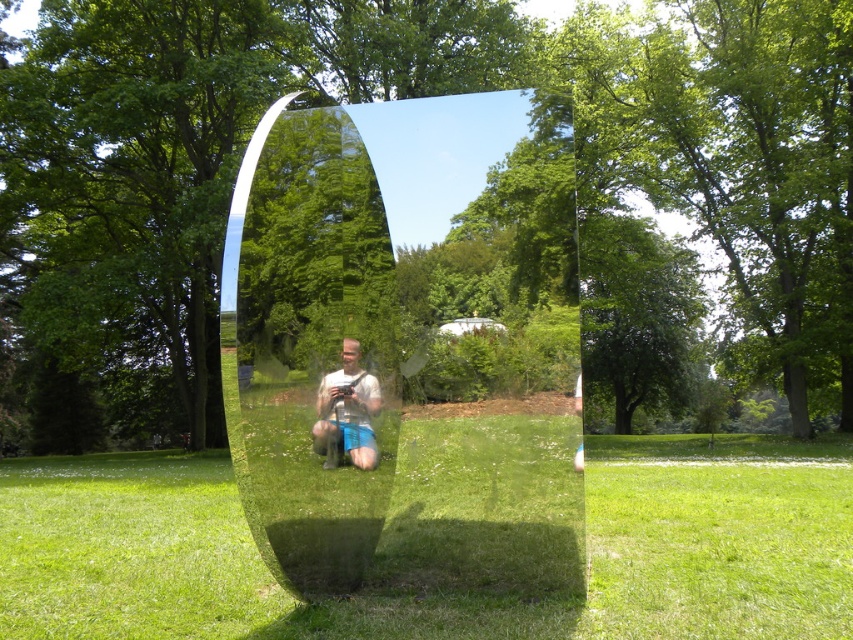
Describe the element at coordinates (407, 344) in the screenshot. The height and width of the screenshot is (640, 853). I see `transparent glass sculpture at center` at that location.

Does point (502, 177) come in front of point (39, 608)?

No, (502, 177) is further to viewer.

Locate an element on the screen. transparent glass sculpture at center is located at coordinates pos(407,344).

Can you confirm if green grass at lower center is bigger than matte silver camera at center?

Correct, green grass at lower center is larger in size than matte silver camera at center.

Between green grass at lower center and matte silver camera at center, which one has less height?

With less height is matte silver camera at center.

Who is more forward, (767, 444) or (350, 348)?

Point (350, 348)

The width and height of the screenshot is (853, 640). I want to click on green grass at lower center, so click(x=433, y=592).

Which is more to the right, transparent glass sculpture at center or matte silver camera at center?

transparent glass sculpture at center

Is point (349, 320) positioned in front of point (332, 451)?

No.

At what (x,y) coordinates should I click in order to perform the action: click on transparent glass sculpture at center. Please return your answer as a coordinate pair (x, y). The image size is (853, 640). Looking at the image, I should click on (407, 344).